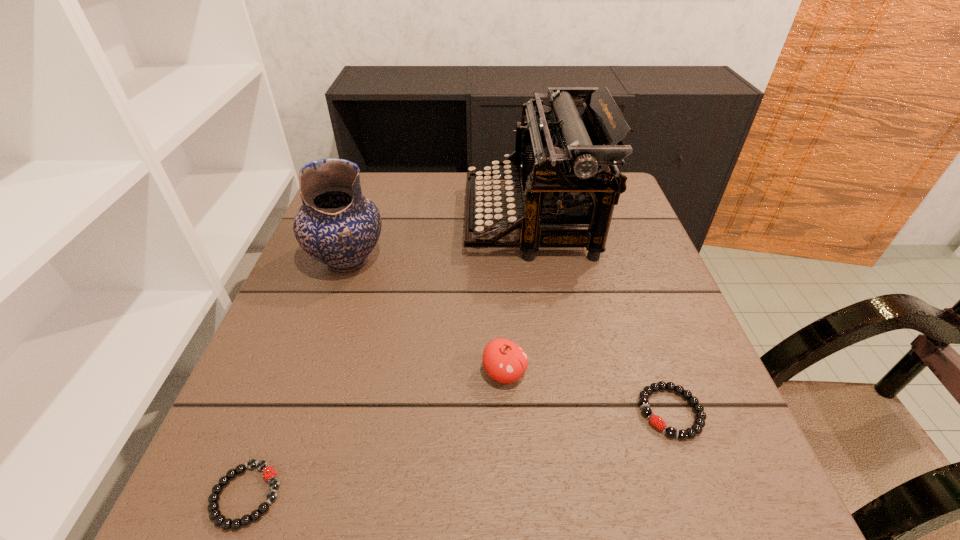
At what (x,y) coordinates should I click in order to perform the action: click on blank space that satisfies the following two spatial constraints: 1. on the back side of the farther bracelet; 2. on the typing side of the typewriter. Please return your answer as a coordinate pair (x, y). Looking at the image, I should click on (602, 220).